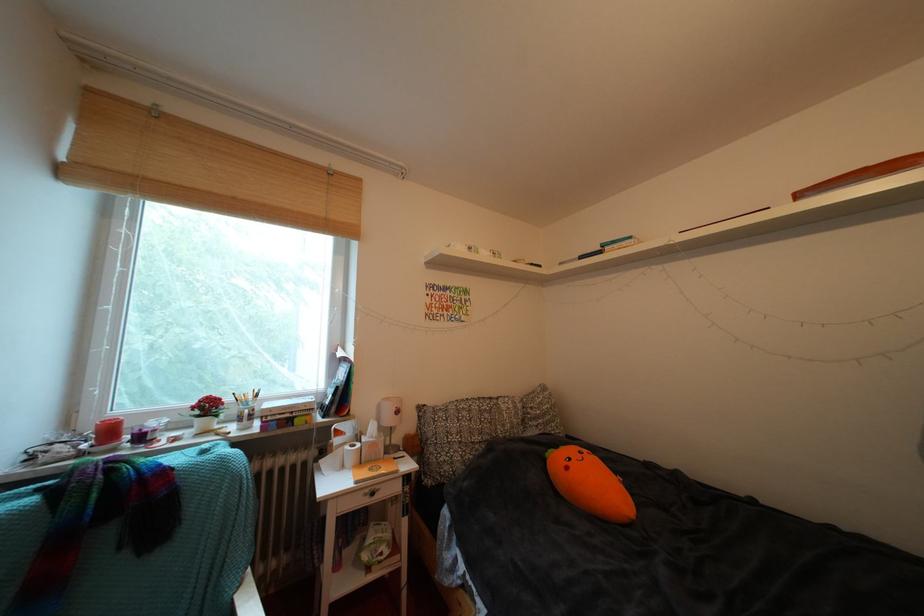
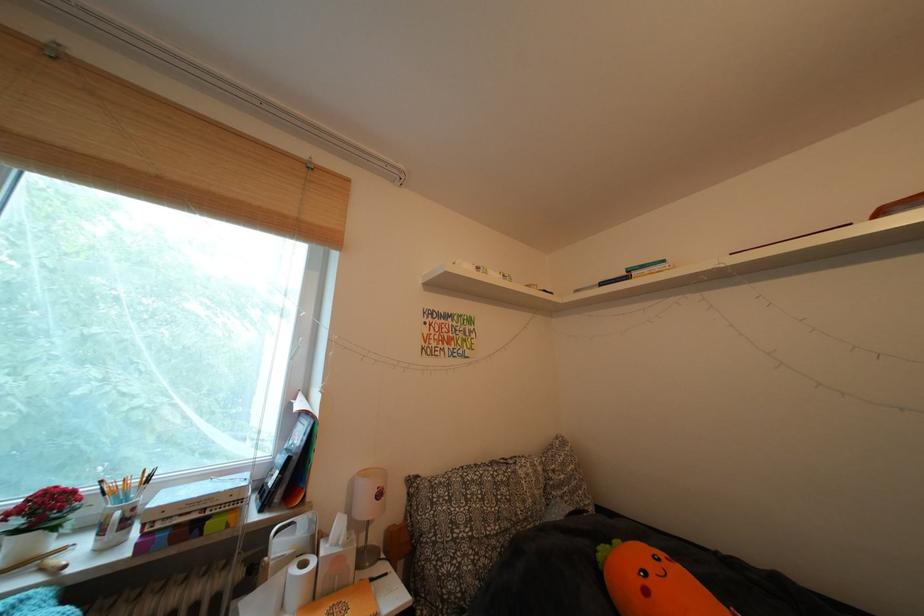
Locate, in the second image, the point that corresponds to (276,411) in the first image.

(172, 504)